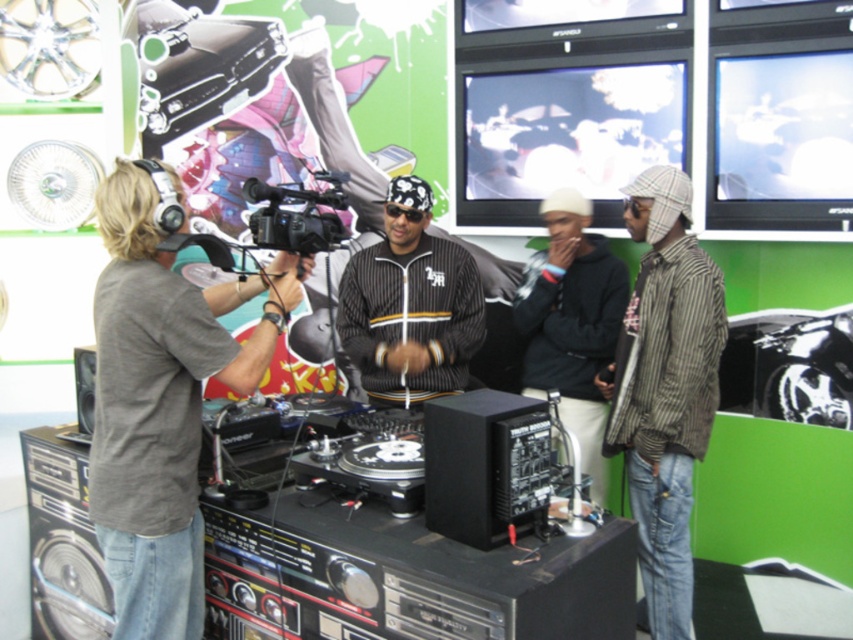
In the scene shown: You are a photographer at the DJ event. You want to take a photo of both the striped cotton shirt at right and the black pinstripe jacket at center. Can you fit both in your camera frame which has a maximum width of 30 inches?

The striped cotton shirt at right and black pinstripe jacket at center are 30.25 inches apart from each other. Since the distance between them exceeds the camera frame width of 30 inches, you cannot fit both in the frame.

You are organizing a photo shoot and need to place a lighting rig between the gray cotton shirt at left and the black matte hoodie at center. The rig requires at least 1 meter of space between them. Can you confirm if there is enough space?

The gray cotton shirt at left might be wider than black matte hoodie at center, but without specific distance information, it is uncertain if there is enough space for the lighting rig requiring 1 meter between them.